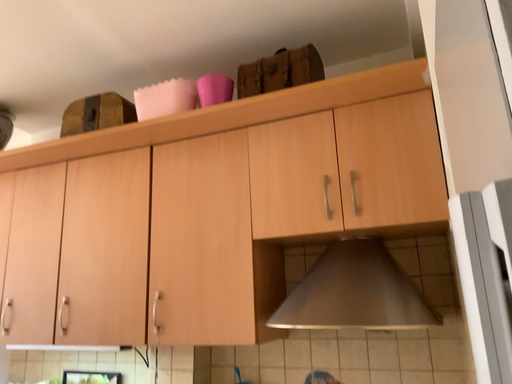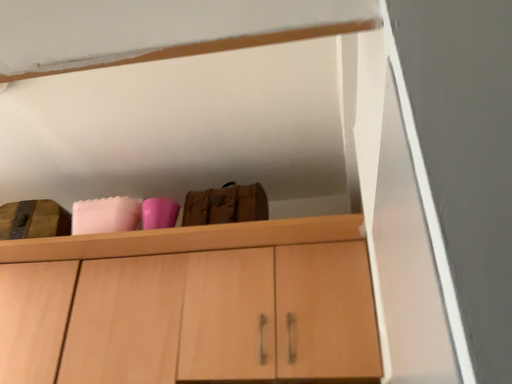
Question: How did the camera likely rotate when shooting the video?

Choices:
 (A) rotated downward
 (B) rotated upward

Answer: (B)